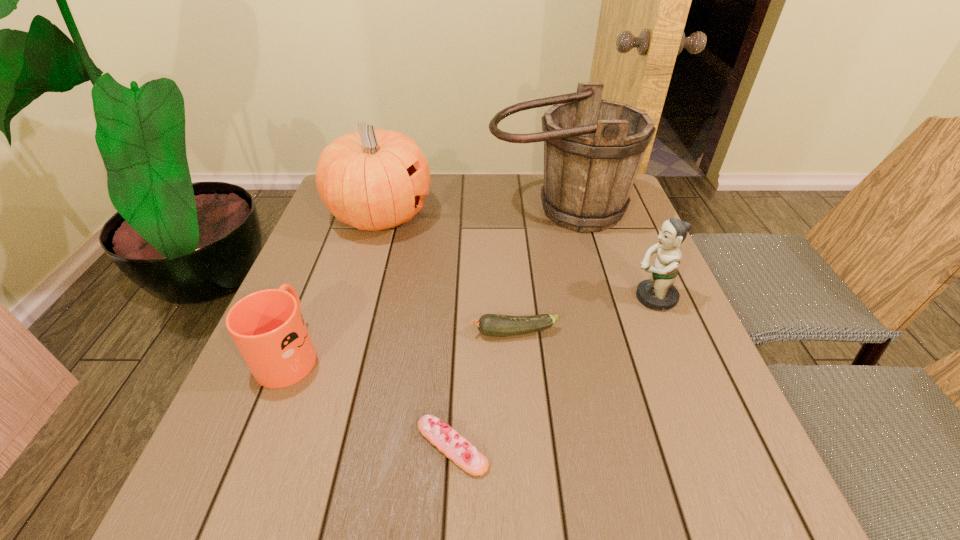
Locate an element on the screen. bucket that is at the far edge is located at coordinates (593, 148).

Locate an element on the screen. This screenshot has height=540, width=960. pumpkin at the far edge is located at coordinates (370, 179).

What are the coordinates of `object located in the near edge section of the desktop` in the screenshot? It's located at (454, 446).

The width and height of the screenshot is (960, 540). In order to click on pumpkin at the left edge in this screenshot , I will do `click(370, 179)`.

Locate an element on the screen. mug that is at the left edge is located at coordinates (267, 326).

Locate an element on the screen. bucket situated at the right edge is located at coordinates (593, 148).

I want to click on figurine that is at the right edge, so click(x=658, y=293).

You are a GUI agent. You are given a task and a screenshot of the screen. Output one action in this format:
    pyautogui.click(x=<x>, y=<y>)
    Task: Click on the object that is at the far left corner
    The image size is (960, 540).
    Given the screenshot: What is the action you would take?
    pyautogui.click(x=370, y=179)

This screenshot has height=540, width=960. In order to click on object present at the far right corner in this screenshot , I will do [x=593, y=148].

In the image, there is a desktop. Identify the location of free region at the far edge. This screenshot has height=540, width=960. (529, 190).